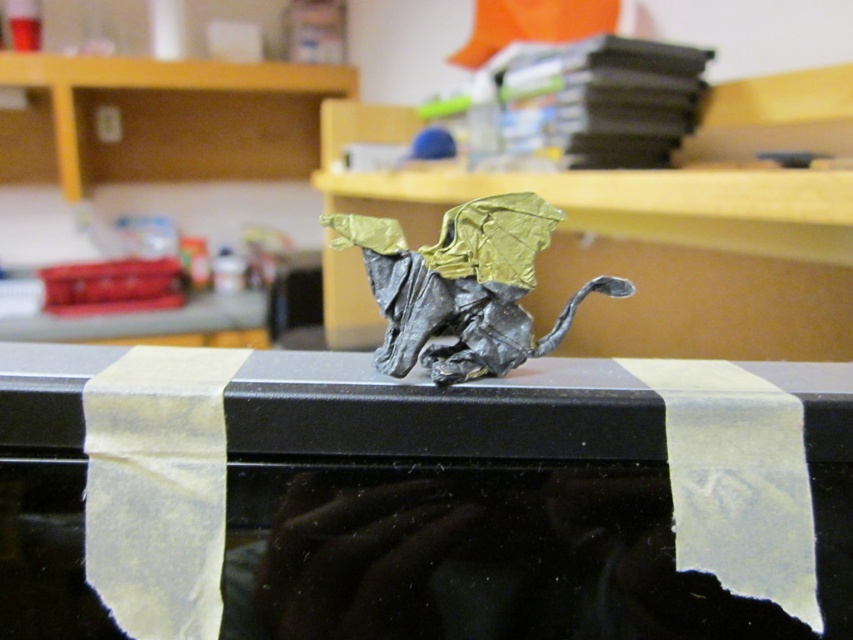
You are a photographer trying to capture the metallic gold origami at center. You need to place a small reflector at point (459,508) to highlight the dragon wings. Is this point on the dragon or the surface?

The point (459,508) is on the metallic gold origami at center, so the reflector should be placed there to highlight the dragon wings.

You are an artist trying to place a new metallic sculpture on the table. The table has limited space. You have two options from the image, the metallic gold origami at center and the gold metallic dragon at center. Which one requires more space horizontally?

The metallic gold origami at center requires more horizontal space because its width is larger than the gold metallic dragon at center.

You are holding a small origami crane that is 3 inches tall. You want to place it on the table next to the metallic gold origami at center without touching it. What is the minimum distance you should keep between them?

The minimum distance you should keep between the metallic gold origami at center and the crane is 23.84 inches, since the viewer is 26.84 inches away from the metallic gold origami at center and the crane is 3 inches tall.